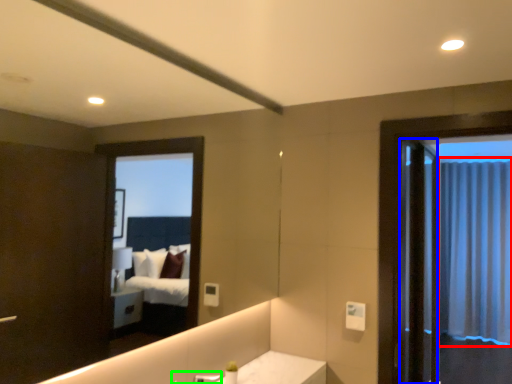
Question: Which is farther away from curtain (highlighted by a red box)? screen door (highlighted by a blue box) or faucet (highlighted by a green box)?

Choices:
 (A) screen door
 (B) faucet

Answer: (B)